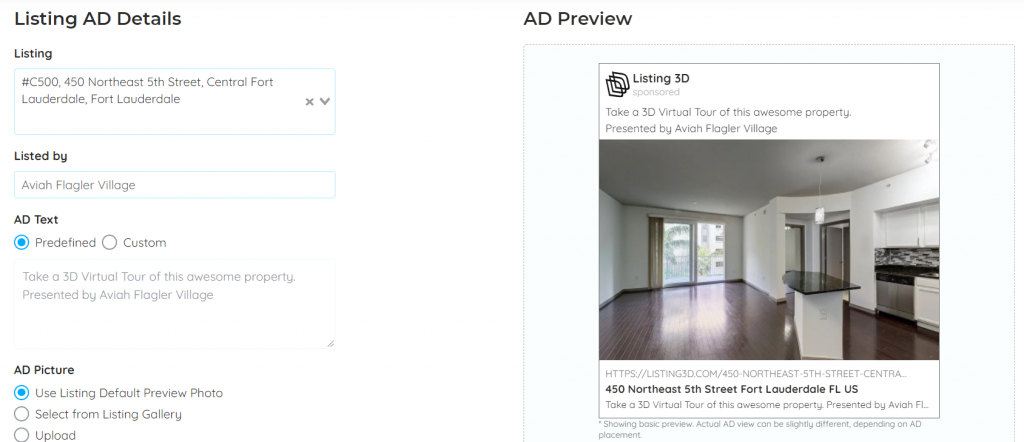
Where is `door`? door is located at coordinates (677, 232), (708, 241), (793, 239), (840, 242).